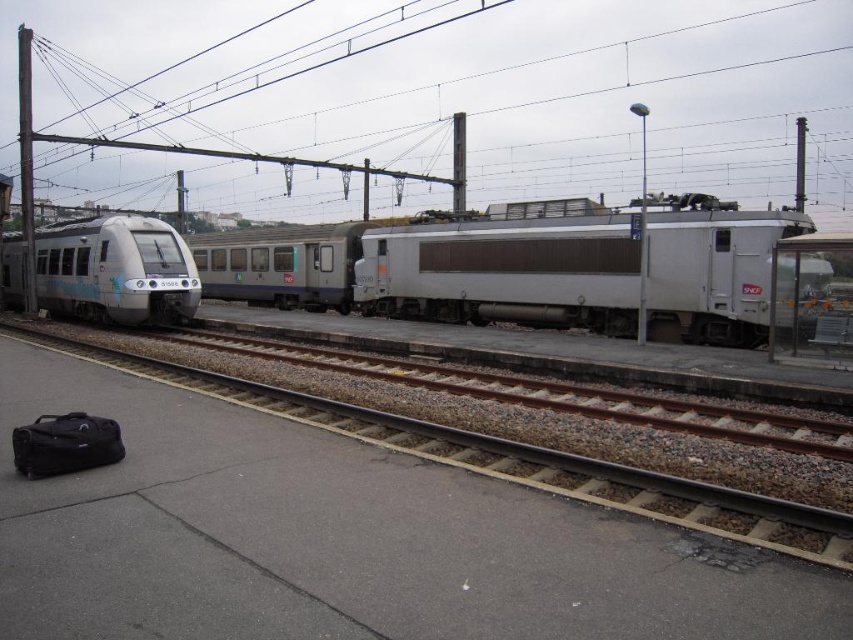
Question: Is metallic wire at upper center positioned at the back of brown gravel train track at center?

Choices:
 (A) yes
 (B) no

Answer: (A)

Question: Does brown gravel train track at center appear on the left side of silver metallic train at left?

Choices:
 (A) yes
 (B) no

Answer: (B)

Question: Which of the following is the farthest from the observer?

Choices:
 (A) gray gravel train track at center
 (B) brown gravel train track at center
 (C) metallic wire at upper center
 (D) silver metallic train at center

Answer: (C)

Question: Which object is positioned closest to the metallic wire at upper center?

Choices:
 (A) black fabric bag at lower left
 (B) gray gravel train track at center

Answer: (A)

Question: Does silver metallic train at center lie in front of brown gravel train track at center?

Choices:
 (A) no
 (B) yes

Answer: (A)

Question: Which is nearer to the silver metallic train at center?

Choices:
 (A) brown gravel train track at center
 (B) black fabric bag at lower left
 (C) silver metallic train at left
 (D) metallic wire at upper center

Answer: (A)